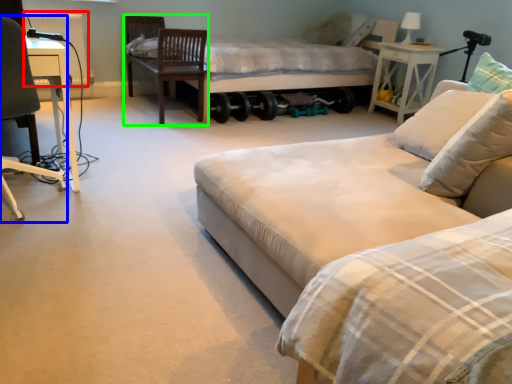
Question: Estimate the real-world distances between objects in this image. Which object is closer to radiator (highlighted by a red box), chair (highlighted by a blue box) or swivel chair (highlighted by a green box)?

Choices:
 (A) chair
 (B) swivel chair

Answer: (B)